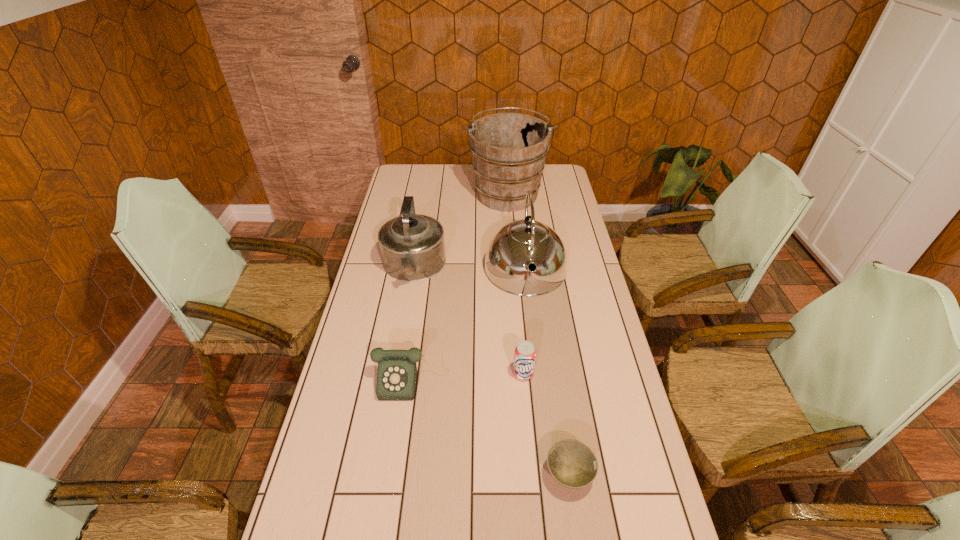
This screenshot has width=960, height=540. I want to click on the farthest object, so click(509, 150).

You are a GUI agent. You are given a task and a screenshot of the screen. Output one action in this format:
    pyautogui.click(x=<x>, y=<y>)
    Task: Click on the right kettle
    The height and width of the screenshot is (540, 960).
    Given the screenshot: What is the action you would take?
    pyautogui.click(x=513, y=247)

Identify the location of the left kettle. (412, 247).

Where is `the fourth shortest object`? The image size is (960, 540). the fourth shortest object is located at coordinates coord(412,247).

Locate an element on the screen. soda can is located at coordinates [x=525, y=354].

Identify the location of telephone. (397, 372).

I want to click on bowl, so click(x=572, y=464).

Identify the location of the shortest object. (572, 464).

Identify the location of vacant position located 0.070m on the handle side of the farthest object. (505, 165).

You are a GUI agent. You are given a task and a screenshot of the screen. Output one action in this format:
    pyautogui.click(x=<x>, y=<y>)
    Task: Click on the vacant area situated 0.140m from the spout of the right kettle
    The width and height of the screenshot is (960, 540).
    Given the screenshot: What is the action you would take?
    pyautogui.click(x=533, y=333)